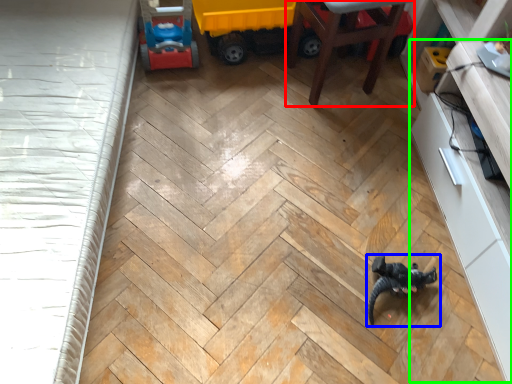
Question: Estimate the real-world distances between objects in this image. Which object is closer to furniture (highlighted by a red box), toy (highlighted by a blue box) or dresser (highlighted by a green box)?

Choices:
 (A) toy
 (B) dresser

Answer: (B)